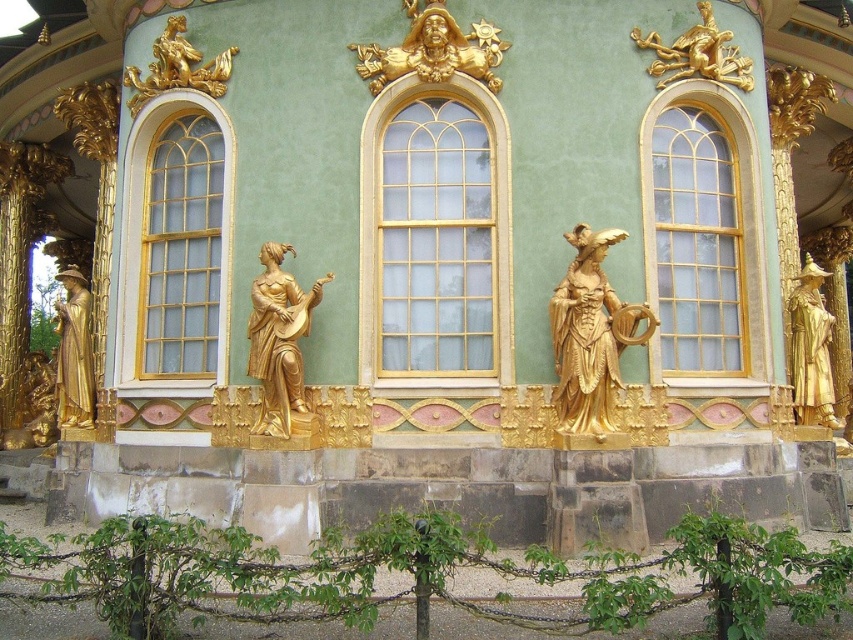
You are an architect analyzing the building facade. The clear glass window at center left is crucial for natural light. Where exactly is this window located in terms of coordinates?

The clear glass window at center left is located at coordinates point (175, 241).